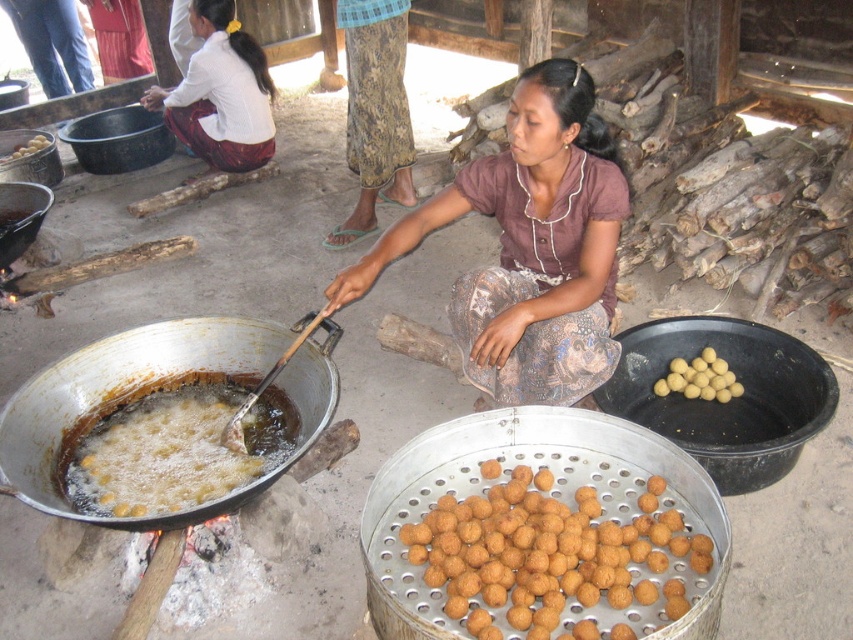
Consider the image. Does golden crispy balls at center have a lesser height compared to yellow matte balls at center?

No.

Who is lower down, golden crispy balls at center or yellow matte balls at center?

golden crispy balls at center is lower down.

Find the location of a particular element. The width and height of the screenshot is (853, 640). golden crispy balls at center is located at coordinates tap(550, 554).

Looking at this image, who is positioned more to the right, golden crispy balls at center or golden matte balls at center?

golden matte balls at center

Find the location of a particular element. The image size is (853, 640). golden crispy balls at center is located at coordinates (550, 554).

This screenshot has height=640, width=853. Identify the location of golden crispy balls at center. (550, 554).

Can you confirm if shiny metal wok at lower left is wider than golden crispy balls at lower left?

Correct, the width of shiny metal wok at lower left exceeds that of golden crispy balls at lower left.

Which is behind, point (115, 397) or point (131, 417)?

The point (115, 397) is behind.

In order to click on shiny metal wok at lower left in this screenshot , I will do `click(149, 392)`.

At what (x,y) coordinates should I click in order to perform the action: click on shiny metal wok at lower left. Please return your answer as a coordinate pair (x, y). Looking at the image, I should click on (149, 392).